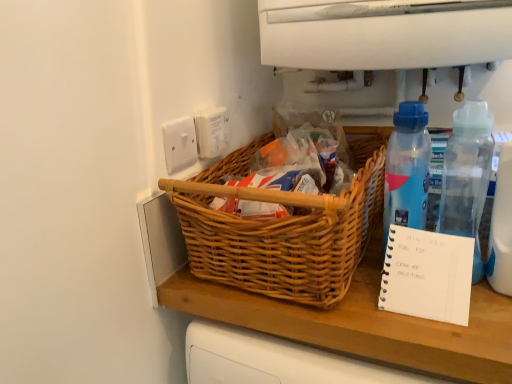
Question: From a real-world perspective, relative to white plastic electric outlet at upper center, marked as the 1th electric outlet in a right-to-left arrangement, is woven wood picnic basket at center vertically above or below?

Choices:
 (A) above
 (B) below

Answer: (B)

Question: From their relative heights in the image, would you say woven wood picnic basket at center is taller or shorter than white plastic electric outlet at upper center, the second electric outlet from the left?

Choices:
 (A) tall
 (B) short

Answer: (A)

Question: Considering the real-world distances, which object is closest to the woven wood picnic basket at center?

Choices:
 (A) white plastic electric outlet at upper center, marked as the 1th electric outlet in a right-to-left arrangement
 (B) transparent plastic bottle at right, positioned as the 1th bottle in right-to-left order
 (C) white spiral notebook at right
 (D) white plastic switch at upper left, acting as the 2th electric outlet starting from the right
 (E) blue translucent bottle at right, placed as the first bottle when sorted from left to right

Answer: (E)

Question: Which of these objects is positioned closest to the white spiral notebook at right?

Choices:
 (A) transparent plastic bottle at right, arranged as the second bottle when viewed from the left
 (B) woven wood picnic basket at center
 (C) white plastic electric outlet at upper center, marked as the 1th electric outlet in a right-to-left arrangement
 (D) white plastic switch at upper left, which ranks as the first electric outlet in left-to-right order
 (E) blue translucent bottle at right, placed as the first bottle when sorted from left to right

Answer: (E)